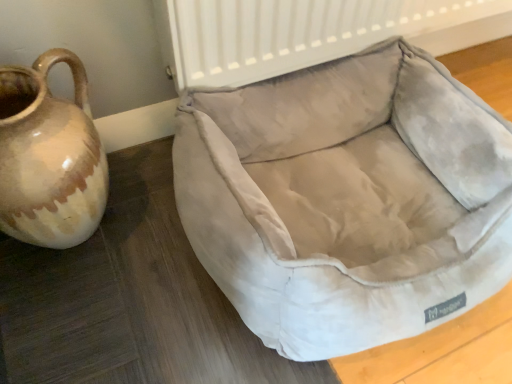
Question: Is brown glazed jug at left taller or shorter than suede-like beige dog bed at center?

Choices:
 (A) tall
 (B) short

Answer: (A)

Question: Considering their positions, is brown glazed jug at left located in front of or behind suede-like beige dog bed at center?

Choices:
 (A) front
 (B) behind

Answer: (B)

Question: Is point (x=54, y=130) closer or farther from the camera than point (x=347, y=321)?

Choices:
 (A) closer
 (B) farther

Answer: (B)

Question: In the image, is suede-like beige dog bed at center on the left side or the right side of brown glazed jug at left?

Choices:
 (A) right
 (B) left

Answer: (A)

Question: In terms of width, does suede-like beige dog bed at center look wider or thinner when compared to brown glazed jug at left?

Choices:
 (A) thin
 (B) wide

Answer: (B)

Question: From their relative heights in the image, would you say suede-like beige dog bed at center is taller or shorter than brown glazed jug at left?

Choices:
 (A) tall
 (B) short

Answer: (B)

Question: From the image's perspective, is suede-like beige dog bed at center located above or below brown glazed jug at left?

Choices:
 (A) above
 (B) below

Answer: (B)